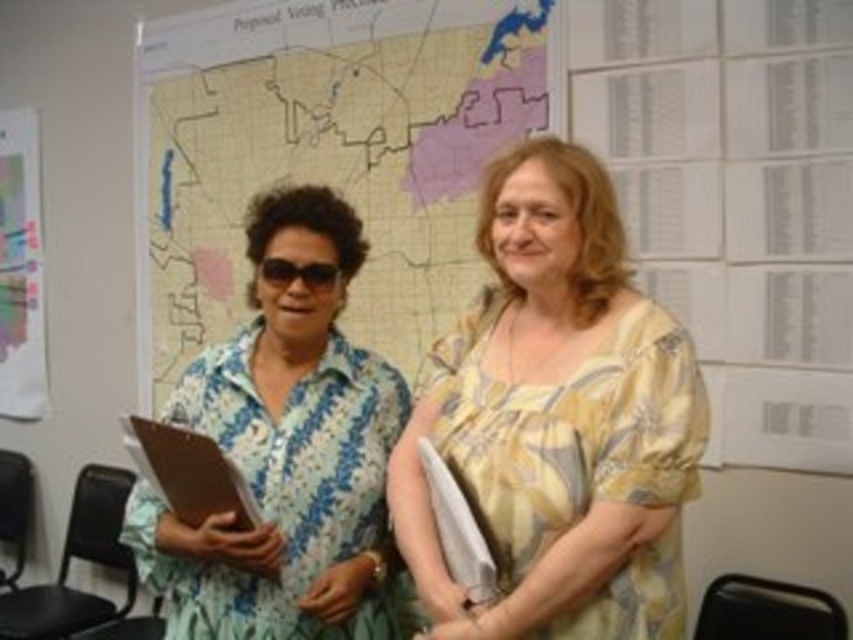
Question: Is yellow floral blouse at center smaller than brown wood clipboard at left?

Choices:
 (A) no
 (B) yes

Answer: (A)

Question: Is map at center positioned at the back of yellow floral blouse at center?

Choices:
 (A) no
 (B) yes

Answer: (B)

Question: Which object is closer to the camera taking this photo?

Choices:
 (A) map at center
 (B) black plastic sunglasses at left
 (C) brown wood clipboard at left
 (D) yellow floral blouse at center

Answer: (D)

Question: Which object appears farthest from the camera in this image?

Choices:
 (A) brown wood clipboard at left
 (B) black plastic sunglasses at left
 (C) yellow floral blouse at center

Answer: (B)

Question: Is brown wood clipboard at left further to the viewer compared to black plastic sunglasses at left?

Choices:
 (A) no
 (B) yes

Answer: (A)

Question: Which object appears closest to the camera in this image?

Choices:
 (A) map at center
 (B) brown wood clipboard at left

Answer: (B)